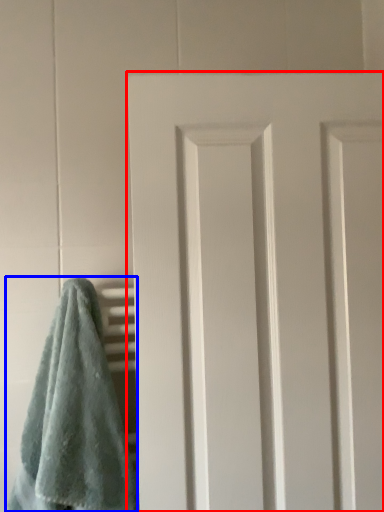
Question: Which of the following is the farthest to the observer, door (highlighted by a red box) or towel (highlighted by a blue box)?

Choices:
 (A) door
 (B) towel

Answer: (A)